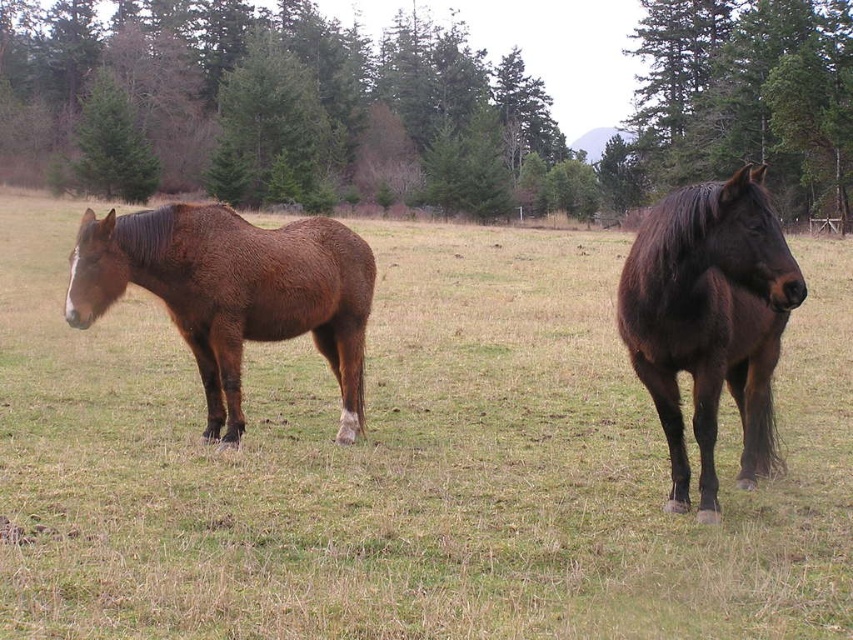
You are a photographer trying to capture the shiny dark brown horse at right in your shot. You notice the green grass at center is blocking part of the horse. Can you move the grass to get a clear view of the horse?

The green grass at center is closer to the viewer than the shiny dark brown horse at right, so you cannot move the grass as it is in front of the horse.